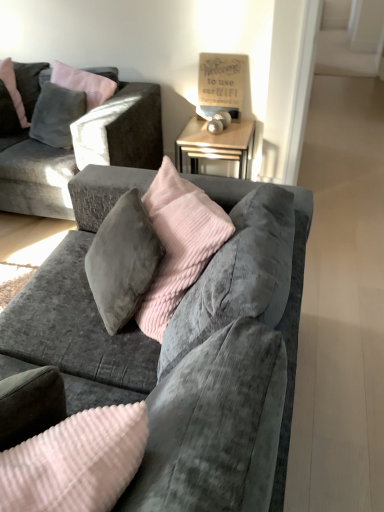
Question: Can you confirm if matte gray pillow at upper left is positioned to the right of velvet gray couch at center, which appears as the first studio couch when viewed from the front?

Choices:
 (A) no
 (B) yes

Answer: (A)

Question: Is matte gray pillow at upper left placed right next to velvet gray couch at center, which appears as the first studio couch when viewed from the front?

Choices:
 (A) no
 (B) yes

Answer: (A)

Question: Does matte gray pillow at upper left have a lesser height compared to velvet gray couch at center, the 2th studio couch from the top?

Choices:
 (A) yes
 (B) no

Answer: (A)

Question: Does matte gray pillow at upper left have a greater width compared to velvet gray couch at center, placed as the first studio couch when sorted from bottom to top?

Choices:
 (A) no
 (B) yes

Answer: (A)

Question: Considering the relative positions of matte gray pillow at upper left and velvet gray couch at center, which is counted as the second studio couch, starting from the back, in the image provided, is matte gray pillow at upper left in front of velvet gray couch at center, which is counted as the second studio couch, starting from the back,?

Choices:
 (A) yes
 (B) no

Answer: (B)

Question: From a real-world perspective, is matte gray pillow at upper left beneath velvet gray couch at center, placed as the first studio couch when sorted from bottom to top?

Choices:
 (A) yes
 (B) no

Answer: (B)

Question: Is velvet gray couch at upper left, the 1th studio couch from the top, taller than matte gray pillow at upper left?

Choices:
 (A) no
 (B) yes

Answer: (B)

Question: Is there a large distance between velvet gray couch at upper left, which is the 1th studio couch in back-to-front order, and matte gray pillow at upper left?

Choices:
 (A) yes
 (B) no

Answer: (B)

Question: Could you tell me if velvet gray couch at upper left, the 1th studio couch from the top, is facing matte gray pillow at upper left?

Choices:
 (A) no
 (B) yes

Answer: (B)

Question: Is the depth of velvet gray couch at upper left, positioned as the 2th studio couch in bottom-to-top order, less than that of matte gray pillow at upper left?

Choices:
 (A) no
 (B) yes

Answer: (B)

Question: Can you confirm if velvet gray couch at upper left, positioned as the 2th studio couch in bottom-to-top order, is wider than matte gray pillow at upper left?

Choices:
 (A) no
 (B) yes

Answer: (B)

Question: Is velvet gray couch at upper left, the 1th studio couch from the top, thinner than matte gray pillow at upper left?

Choices:
 (A) no
 (B) yes

Answer: (A)

Question: Does velvet gray couch at center, which is counted as the second studio couch, starting from the back, lie behind matte gray pillow at upper left?

Choices:
 (A) yes
 (B) no

Answer: (B)